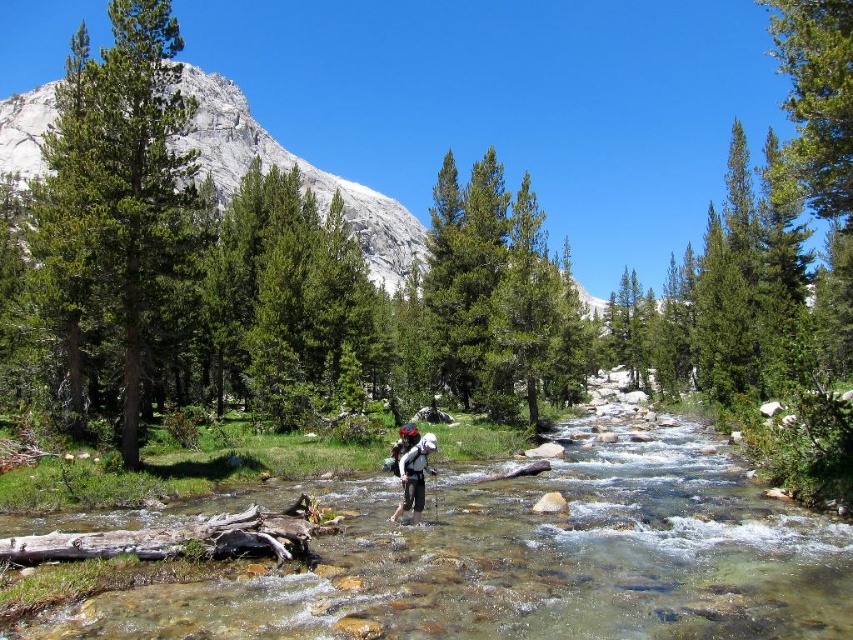
You are a photographer positioned at the camera location. You want to take a photo that includes both point (202, 150) and point (399, 476). Which point will appear closer to the front of the photo?

Point (202, 150) is further to the camera than point (399, 476), so in the photo, point (202, 150) will appear closer to the front of the photo.